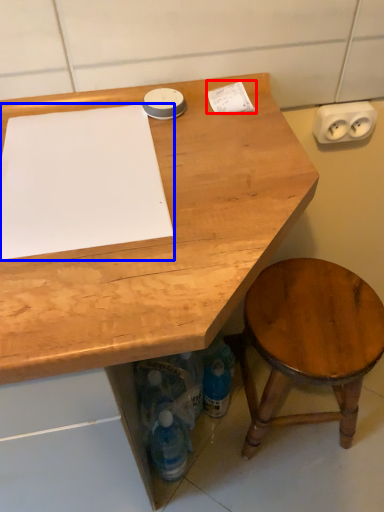
Question: Among these objects, which one is farthest to the camera, notepad (highlighted by a red box) or notepad (highlighted by a blue box)?

Choices:
 (A) notepad
 (B) notepad

Answer: (A)